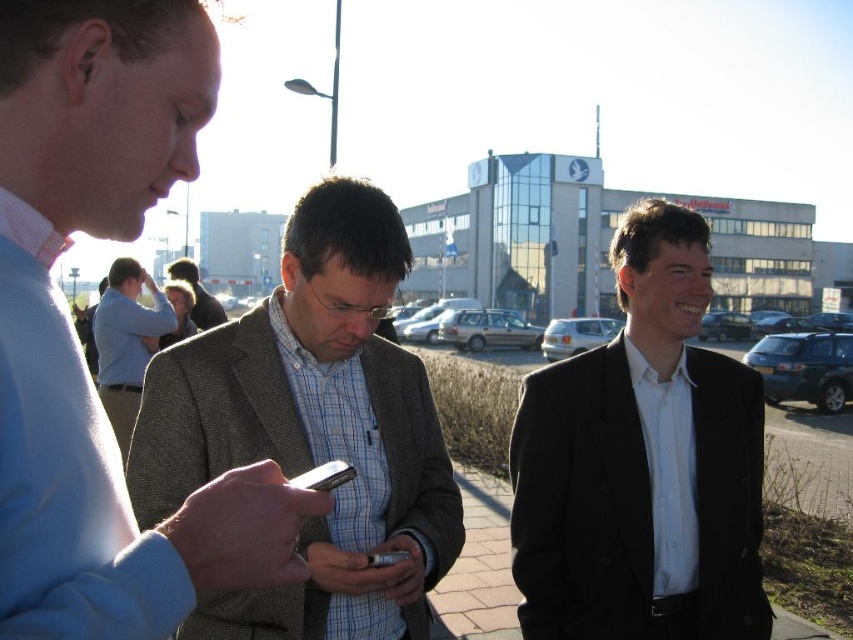
Does light brown textured blazer at center appear on the left side of metallic silver smartphone at center?

Indeed, light brown textured blazer at center is positioned on the left side of metallic silver smartphone at center.

Does point (178, 260) lie in front of point (323, 470)?

That is False.

The width and height of the screenshot is (853, 640). I want to click on light brown textured blazer at center, so click(196, 294).

Who is more distant from viewer, (120, 321) or (172, 269)?

Positioned behind is point (172, 269).

Which is in front, point (148, 340) or point (194, 298)?

Point (148, 340)

Where is `light blue shirt at center`? light blue shirt at center is located at coordinates (126, 342).

Looking at this image, which of these two, black matte suit at right or light brown textured blazer at center, stands shorter?

With less height is light brown textured blazer at center.

Is black matte suit at right below light brown textured blazer at center?

Indeed, black matte suit at right is positioned under light brown textured blazer at center.

Who is more distant from viewer, (691, 371) or (180, 280)?

The point (180, 280) is behind.

Identify the location of black matte suit at right. The height and width of the screenshot is (640, 853). (642, 464).